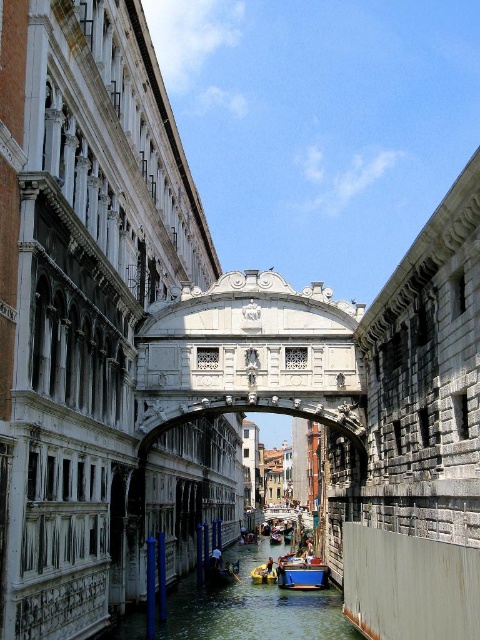
You are standing at the camera position and want to reach point (127,634). Can you walk directly to it from here?

The distance between point (127,634) and the camera is 73.84 meters, so yes, you can walk directly to it from here as there is no obstruction mentioned in the scene description.

You are an architect analyzing the spatial relationships in the image. Based on the scene, which object is positioned higher relative to the other between the greenish water at center and the blue matte boat at center?

The greenish water at center is taller than the blue matte boat at center, meaning the water is positioned higher relative to the boat.

You are standing on the Bridge of Sighs in Venice and notice a greenish water at center and a blue matte boat at center. Which object is nearer to you?

The greenish water at center is closer to the viewer than the blue matte boat at center.